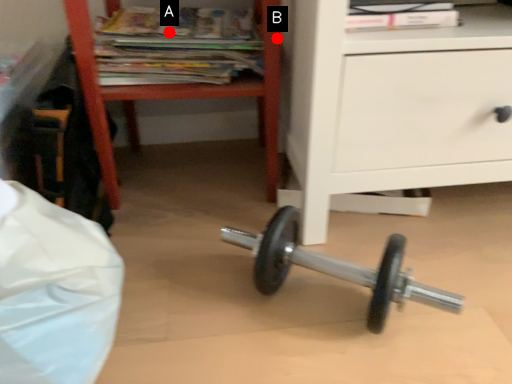
Question: Two points are circled on the image, labeled by A and B beside each circle. Which point is farther from the camera taking this photo?

Choices:
 (A) A is further
 (B) B is further

Answer: (A)